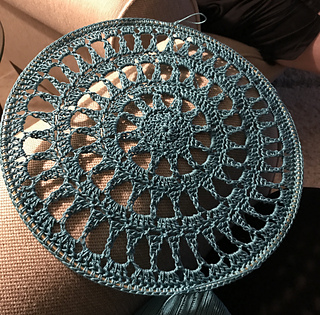
Locate an element on the screen. This screenshot has width=320, height=315. bottom of dreamcatcher is located at coordinates pyautogui.click(x=196, y=300).